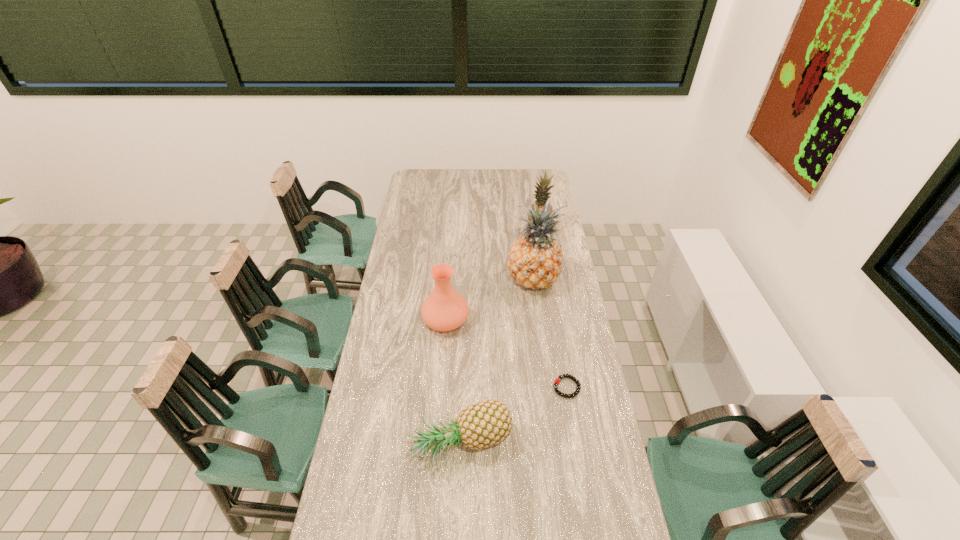
You are a GUI agent. You are given a task and a screenshot of the screen. Output one action in this format:
    pyautogui.click(x=<x>, y=<y>)
    Task: Click on the object that stands as the fourth closest to the bracelet
    The height and width of the screenshot is (540, 960).
    Given the screenshot: What is the action you would take?
    pyautogui.click(x=541, y=194)

Identify which pineapple is the closest to the fourth tallest object. Please provide its 2D coordinates. Your answer should be formatted as a tuple, i.e. [(x, y)], where the tuple contains the x and y coordinates of a point satisfying the conditions above.

[(535, 259)]

Locate which pineapple is the closest to the second farthest pineapple. Please provide its 2D coordinates. Your answer should be formatted as a tuple, i.e. [(x, y)], where the tuple contains the x and y coordinates of a point satisfying the conditions above.

[(541, 194)]

Where is `vacant space that satisfies the following two spatial constraints: 1. on the back side of the fourth tallest object; 2. on the left side of the second farthest pineapple`? This screenshot has width=960, height=540. vacant space that satisfies the following two spatial constraints: 1. on the back side of the fourth tallest object; 2. on the left side of the second farthest pineapple is located at coordinates (467, 280).

Where is `blank area in the image that satisfies the following two spatial constraints: 1. on the back side of the farthest pineapple; 2. on the left side of the fourth nearest object`? This screenshot has width=960, height=540. blank area in the image that satisfies the following two spatial constraints: 1. on the back side of the farthest pineapple; 2. on the left side of the fourth nearest object is located at coordinates (527, 233).

Locate an element on the screen. vacant space that satisfies the following two spatial constraints: 1. on the back side of the shortest object; 2. on the left side of the leftmost pineapple is located at coordinates (464, 387).